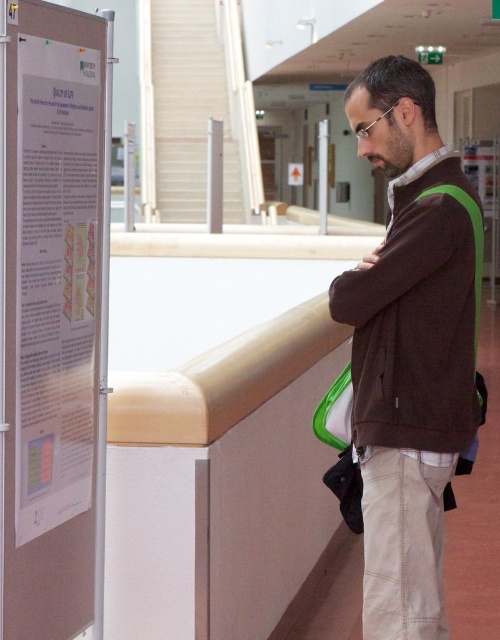
Question: Which point is farther to the camera?

Choices:
 (A) (374, 412)
 (B) (17, 436)

Answer: (A)

Question: Which point is farther to the camera?

Choices:
 (A) (92, 346)
 (B) (407, 230)

Answer: (B)

Question: Does brown fleece jacket at center have a larger size compared to white paper poster at left?

Choices:
 (A) no
 (B) yes

Answer: (B)

Question: Is brown fleece jacket at center smaller than white paper poster at left?

Choices:
 (A) yes
 (B) no

Answer: (B)

Question: Can you confirm if brown fleece jacket at center is wider than white paper poster at left?

Choices:
 (A) yes
 (B) no

Answer: (A)